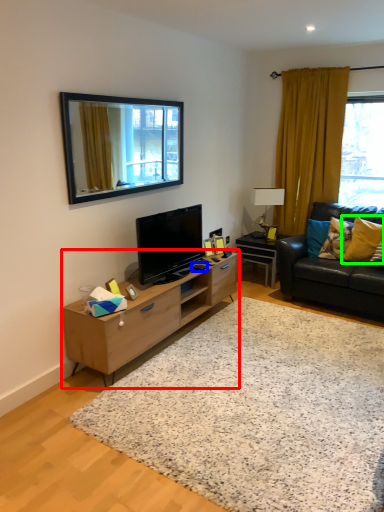
Question: Estimate the real-world distances between objects in this image. Which object is farther from cabinetry (highlighted by a red box), remote control (highlighted by a blue box) or pillow (highlighted by a green box)?

Choices:
 (A) remote control
 (B) pillow

Answer: (B)